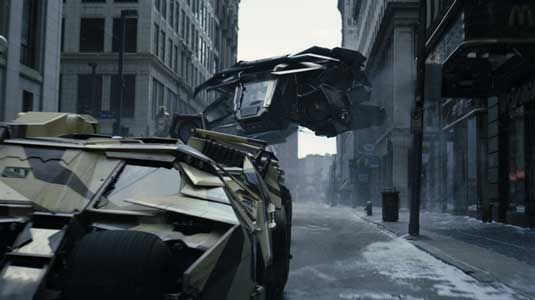
Find the location of a particular element. The image size is (535, 300). black window is located at coordinates (91, 35).